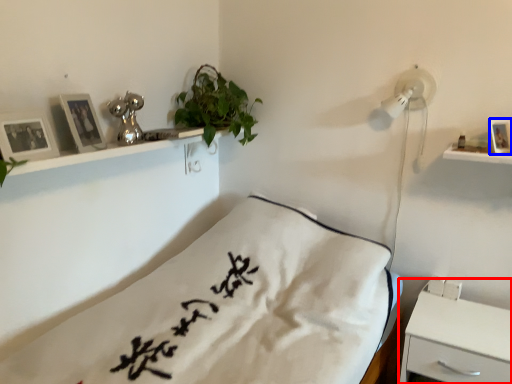
Question: Which of the following is the farthest to the observer, nightstand (highlighted by a red box) or picture frame (highlighted by a blue box)?

Choices:
 (A) nightstand
 (B) picture frame

Answer: (B)